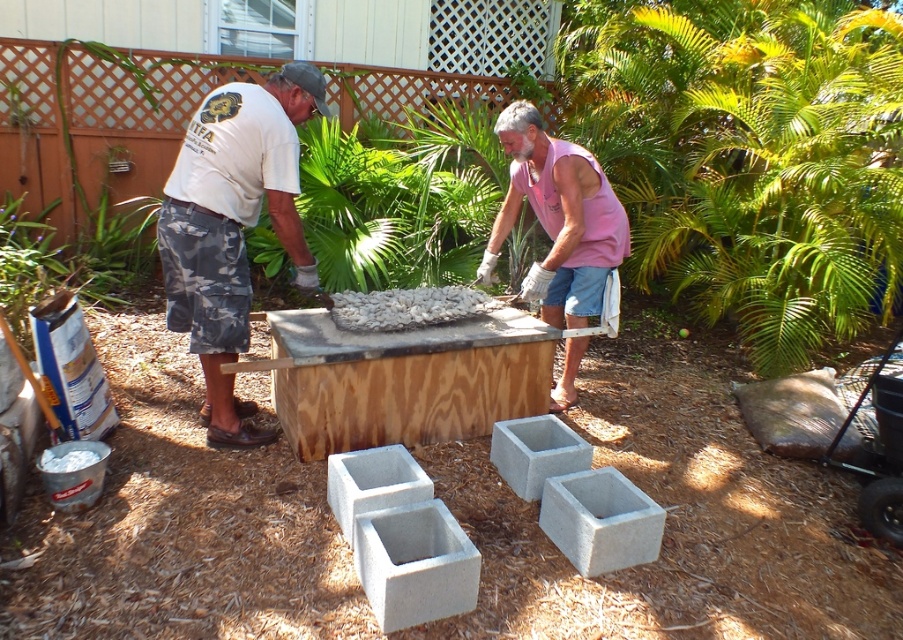
Question: Is pink cotton shirt at center wider than gray concrete block at center?

Choices:
 (A) no
 (B) yes

Answer: (B)

Question: Does white cotton shirt at upper left have a lesser width compared to gray concrete block at center?

Choices:
 (A) no
 (B) yes

Answer: (A)

Question: Among these points, which one is farthest from the camera?

Choices:
 (A) (273, 188)
 (B) (210, 433)
 (C) (562, 275)
 (D) (657, 522)

Answer: (C)

Question: Can you confirm if white matte t-shirt at center is bigger than pink cotton shirt at center?

Choices:
 (A) yes
 (B) no

Answer: (A)

Question: Which point appears farthest from the camera in this image?

Choices:
 (A) (282, 209)
 (B) (256, 128)

Answer: (A)

Question: Estimate the real-world distances between objects in this image. Which object is closer to the white matte t-shirt at center?

Choices:
 (A) pink cotton shirt at center
 (B) white cotton shirt at upper left

Answer: (B)